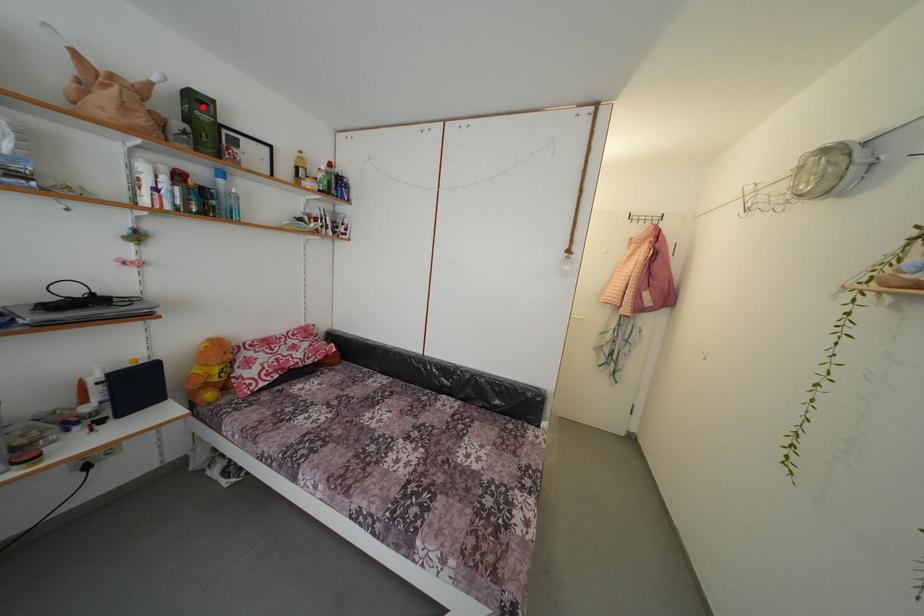
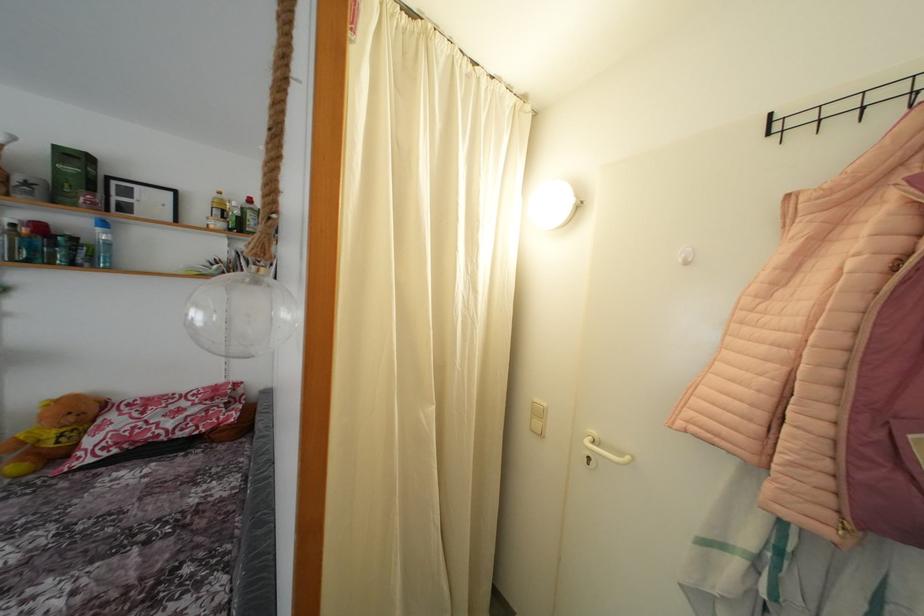
Find the pixel in the second image that matches the highlighted location in the first image.

(80, 163)